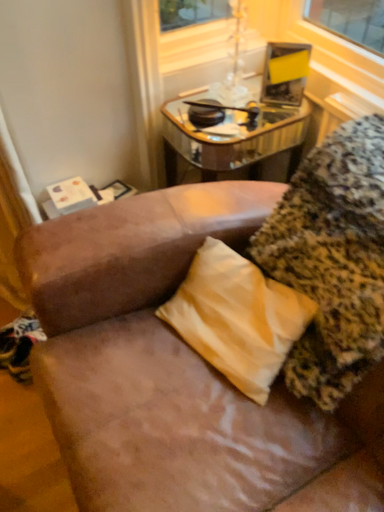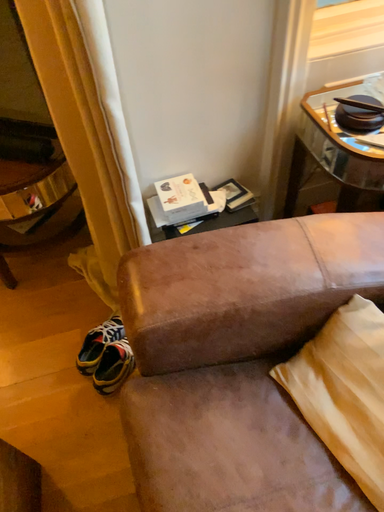
Question: How did the camera likely rotate when shooting the video?

Choices:
 (A) rotated right
 (B) rotated left

Answer: (B)